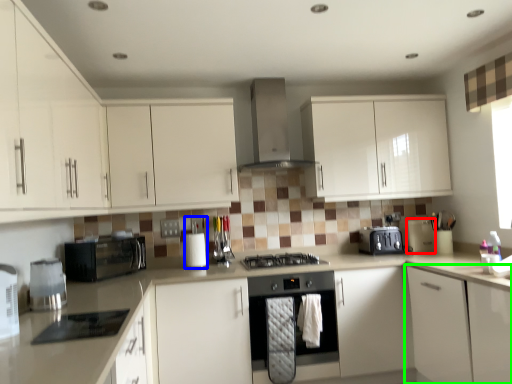
Question: Which is farther away from appliance (highlighted by a red box)? appliance (highlighted by a blue box) or cabinetry (highlighted by a green box)?

Choices:
 (A) appliance
 (B) cabinetry

Answer: (A)